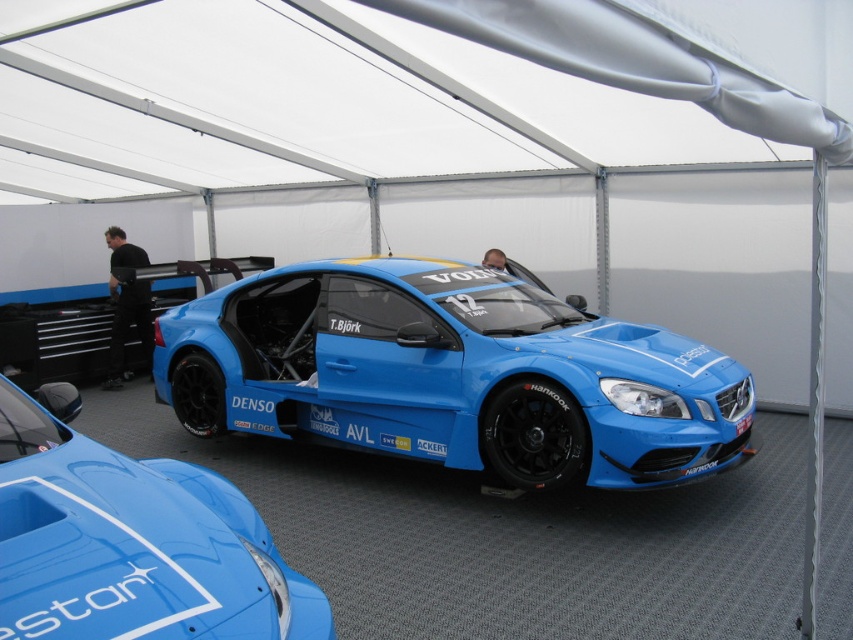
Question: Which of the following is the farthest from the observer?

Choices:
 (A) black fabric man at left
 (B) glossy blue race car at center
 (C) matte blue race car at center
 (D) smooth skin face at center

Answer: (A)

Question: Is the position of glossy blue race car at center less distant than that of black fabric man at left?

Choices:
 (A) no
 (B) yes

Answer: (B)

Question: Can you confirm if black fabric man at left is positioned below smooth skin face at center?

Choices:
 (A) no
 (B) yes

Answer: (B)

Question: Based on their relative distances, which object is farther from the matte blue race car at center?

Choices:
 (A) glossy blue race car at center
 (B) smooth skin face at center
 (C) white fabric canopy at upper center

Answer: (A)

Question: Observing the image, what is the correct spatial positioning of white fabric canopy at upper center in reference to matte blue race car at center?

Choices:
 (A) left
 (B) right

Answer: (A)

Question: Which point is farther to the camera?

Choices:
 (A) glossy blue race car at center
 (B) smooth skin face at center

Answer: (B)